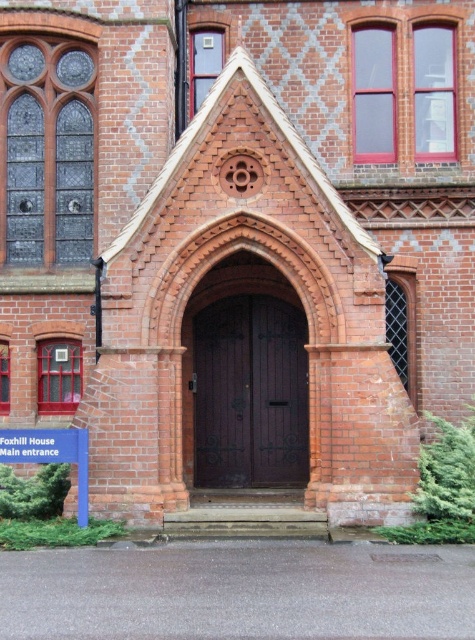
Question: Which of the following is the farthest from the observer?

Choices:
 (A) blue plastic sign at lower left
 (B) dark wood door at center

Answer: (B)

Question: In this image, where is dark wood door at center located relative to blue plastic sign at lower left?

Choices:
 (A) left
 (B) right

Answer: (B)

Question: Does dark wood door at center have a lesser width compared to blue plastic sign at lower left?

Choices:
 (A) yes
 (B) no

Answer: (B)

Question: Which point is closer to the camera taking this photo?

Choices:
 (A) (229, 314)
 (B) (62, 454)

Answer: (B)

Question: In this image, where is dark wood door at center located relative to blue plastic sign at lower left?

Choices:
 (A) left
 (B) right

Answer: (B)